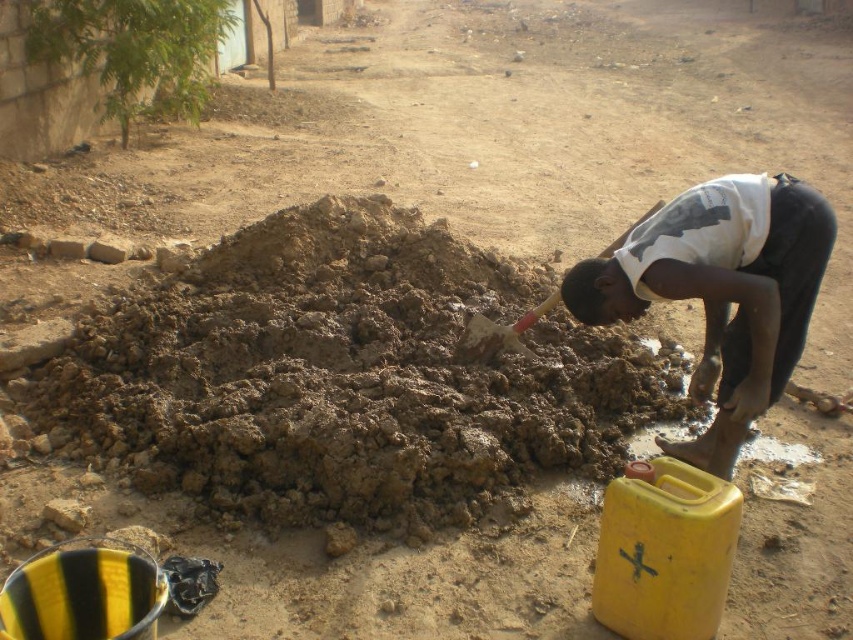
Question: Which of these objects is positioned closest to the dark gray concrete squat at lower right?

Choices:
 (A) wooden handle shovel at center
 (B) brown clay mound at center

Answer: (A)

Question: Based on their relative distances, which object is nearer to the wooden handle shovel at center?

Choices:
 (A) dark gray concrete squat at lower right
 (B) brown clay mound at center

Answer: (B)

Question: Is the position of brown clay mound at center more distant than that of dark gray concrete squat at lower right?

Choices:
 (A) no
 (B) yes

Answer: (B)

Question: Is brown clay mound at center positioned behind dark gray concrete squat at lower right?

Choices:
 (A) yes
 (B) no

Answer: (A)

Question: From the image, what is the correct spatial relationship of brown clay mound at center in relation to dark gray concrete squat at lower right?

Choices:
 (A) above
 (B) below

Answer: (B)

Question: Which object is closer to the camera taking this photo?

Choices:
 (A) wooden handle shovel at center
 (B) brown clay mound at center
 (C) dark gray concrete squat at lower right

Answer: (C)